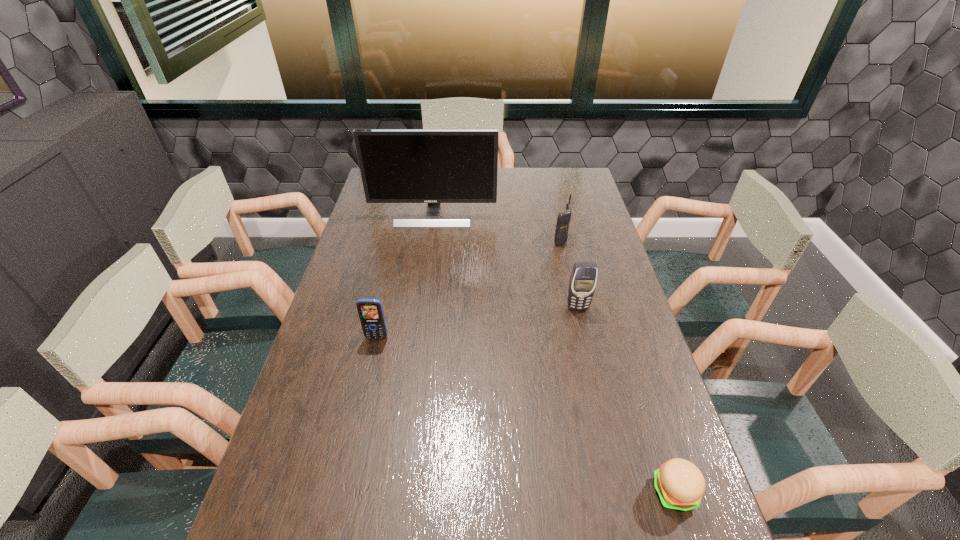
Locate an element on the screen. This screenshot has height=540, width=960. free spot located on the keyboard of the second farthest object is located at coordinates (512, 240).

The image size is (960, 540). I want to click on blank space located on the keyboard of the second farthest object, so click(516, 240).

Find the location of a particular element. This screenshot has width=960, height=540. free region located on the keyboard of the second farthest object is located at coordinates (476, 240).

What are the coordinates of `free space located on the screen of the leftmost cellular telephone` in the screenshot? It's located at (367, 382).

Identify the location of vacant space located on the back of the rightmost object. Image resolution: width=960 pixels, height=540 pixels. (659, 441).

At what (x,y) coordinates should I click in order to perform the action: click on monitor that is at the left edge. Please return your answer as a coordinate pair (x, y). Image resolution: width=960 pixels, height=540 pixels. Looking at the image, I should click on (434, 166).

This screenshot has height=540, width=960. Find the location of `cellular telephone that is at the left edge`. cellular telephone that is at the left edge is located at coordinates (370, 311).

This screenshot has height=540, width=960. In order to click on hamburger that is at the right edge in this screenshot , I will do `click(680, 485)`.

Image resolution: width=960 pixels, height=540 pixels. Identify the location of free space at the far edge of the desktop. (505, 175).

The width and height of the screenshot is (960, 540). Identify the location of free space at the left edge of the desktop. (362, 223).